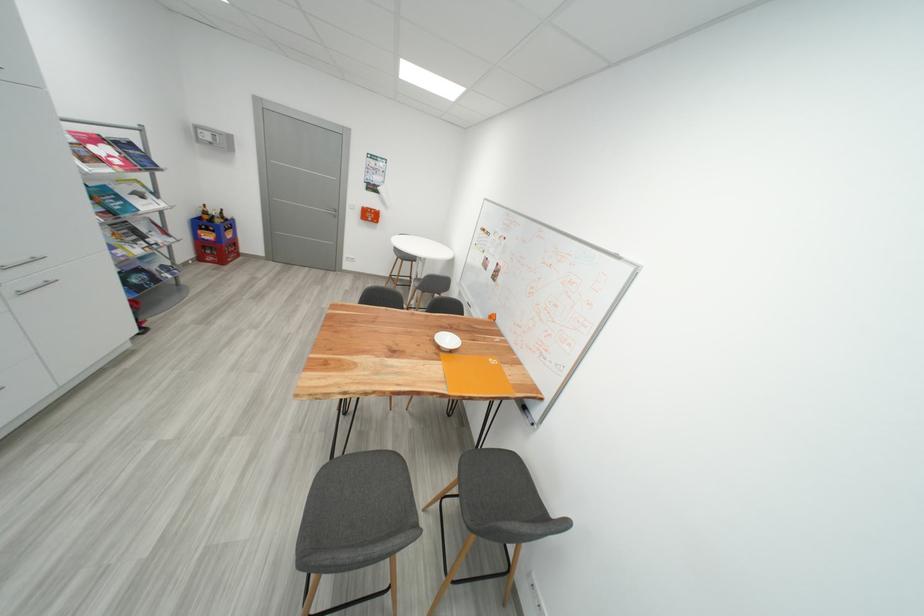
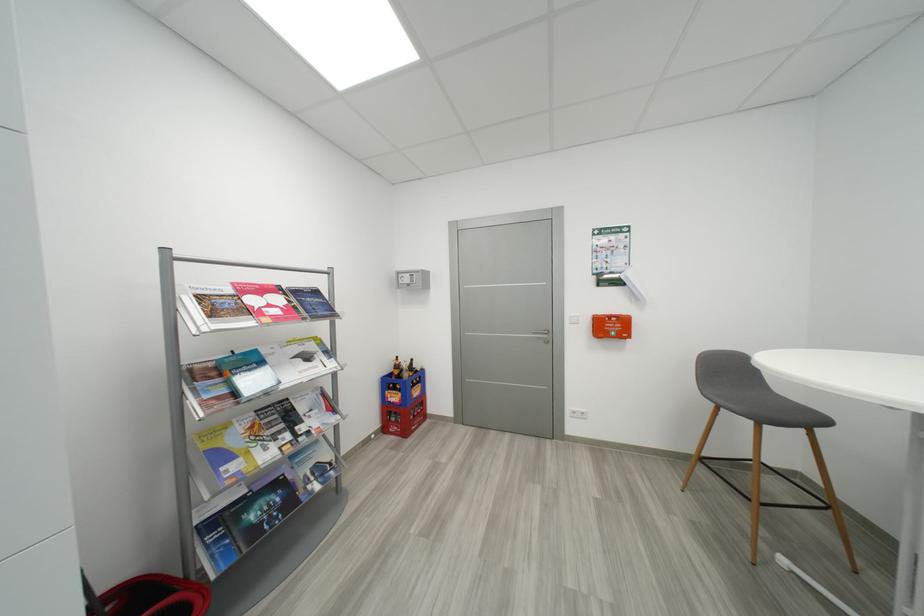
Locate, in the second image, the point that corresponds to point (147, 272) in the first image.

(285, 485)